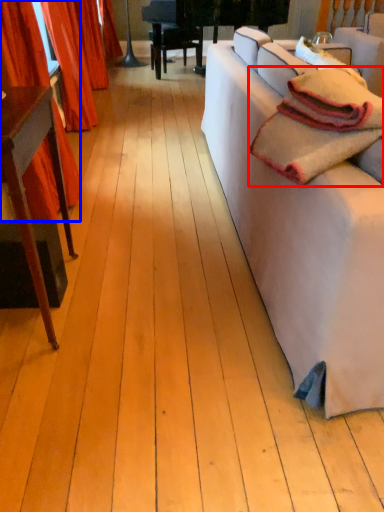
Question: Which object is closer to the camera taking this photo, blanket (highlighted by a red box) or curtain (highlighted by a blue box)?

Choices:
 (A) blanket
 (B) curtain

Answer: (A)